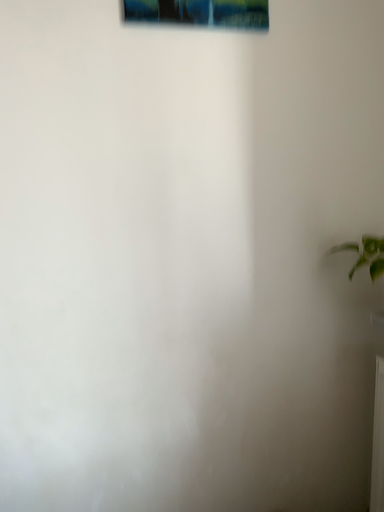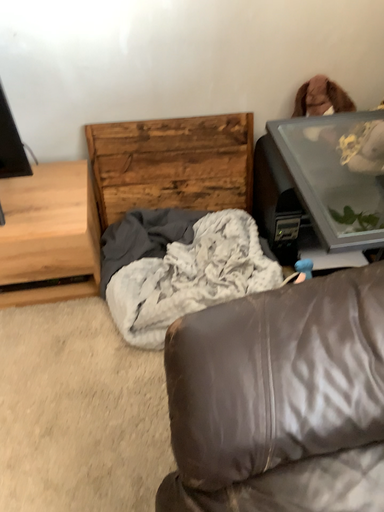
Question: Which way did the camera rotate in the video?

Choices:
 (A) rotated downward
 (B) rotated upward

Answer: (A)